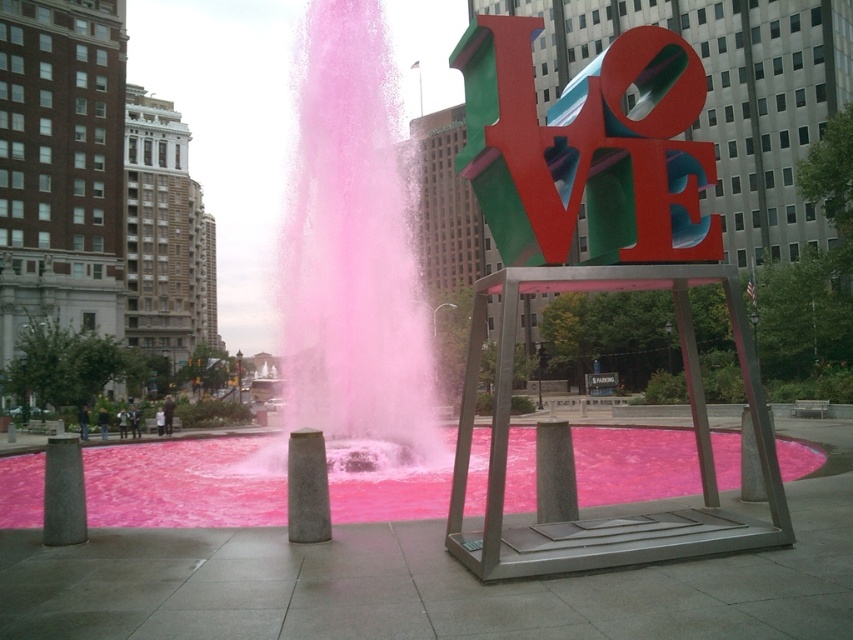
Question: Can you confirm if pink frosted water at center is positioned to the left of pink liquid at fountain center?

Choices:
 (A) no
 (B) yes

Answer: (B)

Question: Which object is the closest to the gray concrete pillar at center?

Choices:
 (A) pink liquid at fountain center
 (B) multicolored metallic sculpture at center
 (C) smooth concrete pillar at lower left

Answer: (C)

Question: Which point is closer to the camera?

Choices:
 (A) (289, 252)
 (B) (341, 492)

Answer: (B)

Question: Which point is closer to the camera?

Choices:
 (A) pink liquid at fountain center
 (B) pink frosted water at center
 (C) gray concrete pillar at center

Answer: (C)

Question: Does pink frosted water at center appear on the right side of smooth concrete pillar at lower left?

Choices:
 (A) yes
 (B) no

Answer: (B)

Question: Does multicolored metallic sculpture at center have a smaller size compared to pink liquid at fountain center?

Choices:
 (A) yes
 (B) no

Answer: (B)